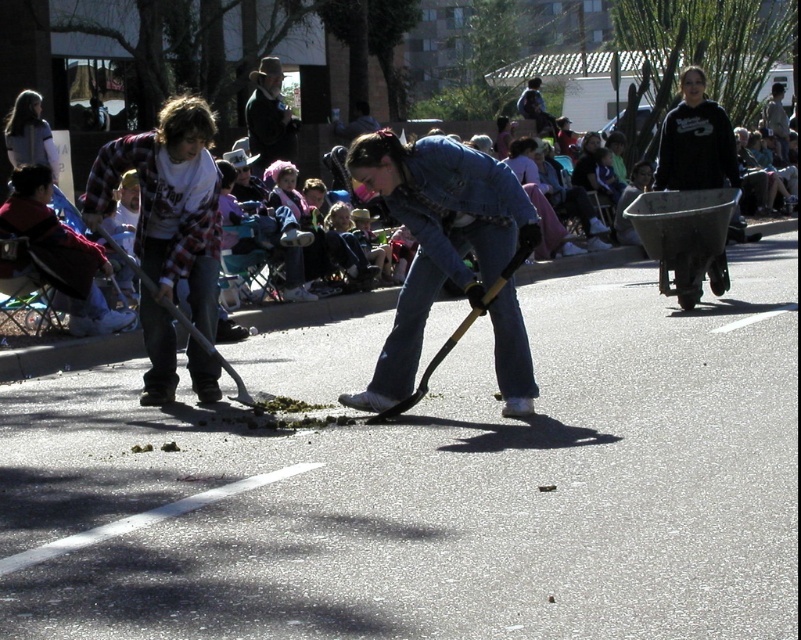
Question: Based on their relative distances, which object is nearer to the jeans at center?

Choices:
 (A) denim jeans at left
 (B) metallic gray wheelbarrow at right

Answer: (A)

Question: Observing the image, what is the correct spatial positioning of metallic gray wheelbarrow at right in reference to denim jeans at left?

Choices:
 (A) above
 (B) below

Answer: (A)

Question: Estimate the real-world distances between objects in this image. Which object is closer to the rustic brown hat at upper center?

Choices:
 (A) flannel plaid shirt at left
 (B) jeans at center
 (C) denim jeans at left

Answer: (C)

Question: Does metallic gray wheelbarrow at right come behind rustic brown hat at upper center?

Choices:
 (A) yes
 (B) no

Answer: (B)

Question: Can you confirm if metallic gray wheelbarrow at right is thinner than denim jeans at left?

Choices:
 (A) yes
 (B) no

Answer: (B)

Question: Estimate the real-world distances between objects in this image. Which object is closer to the denim jeans at left?

Choices:
 (A) jeans at center
 (B) metallic gray wheelbarrow at right
 (C) flannel plaid shirt at left

Answer: (C)